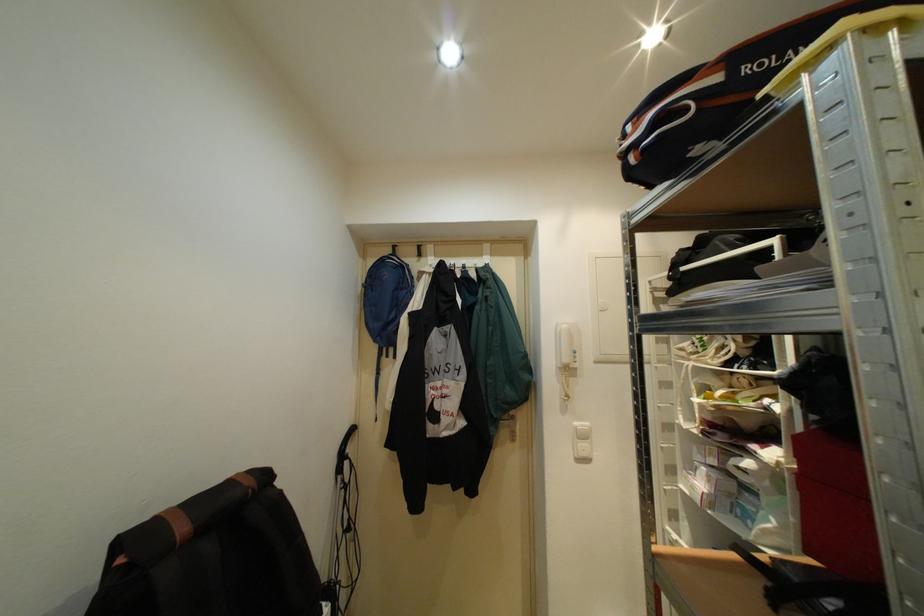
I want to click on white light switch, so click(581, 440).